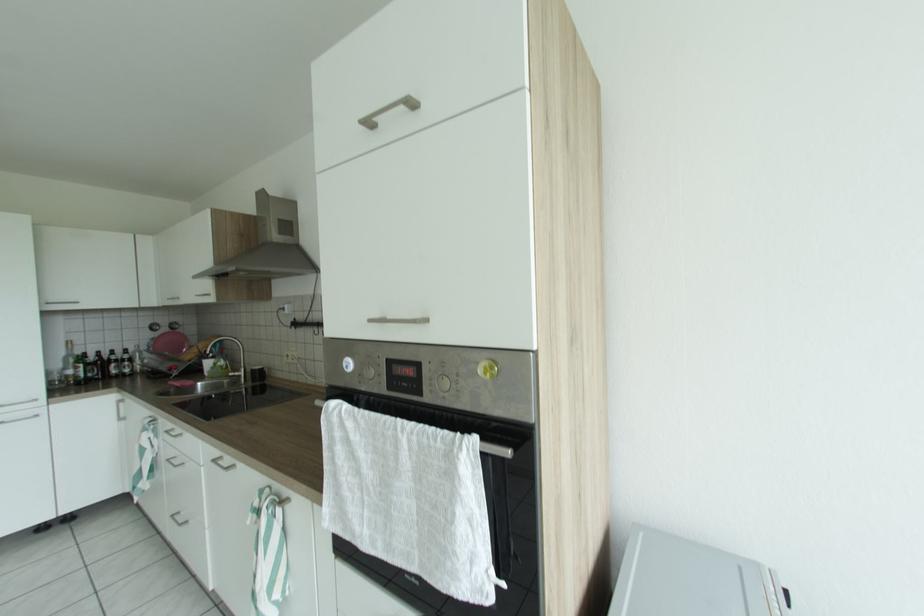
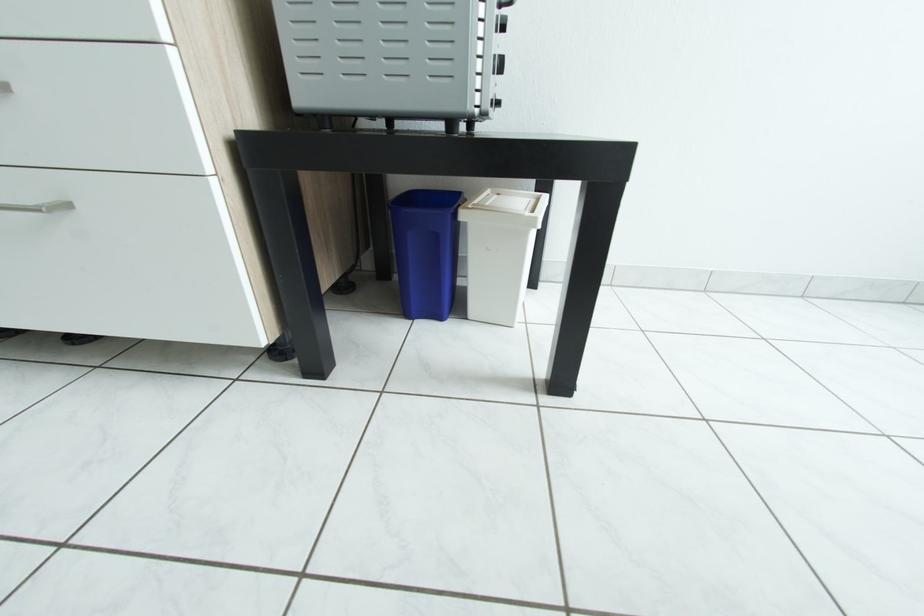
Based on the continuous images, in which direction is the camera rotating?

The camera's rotation is toward right-down.